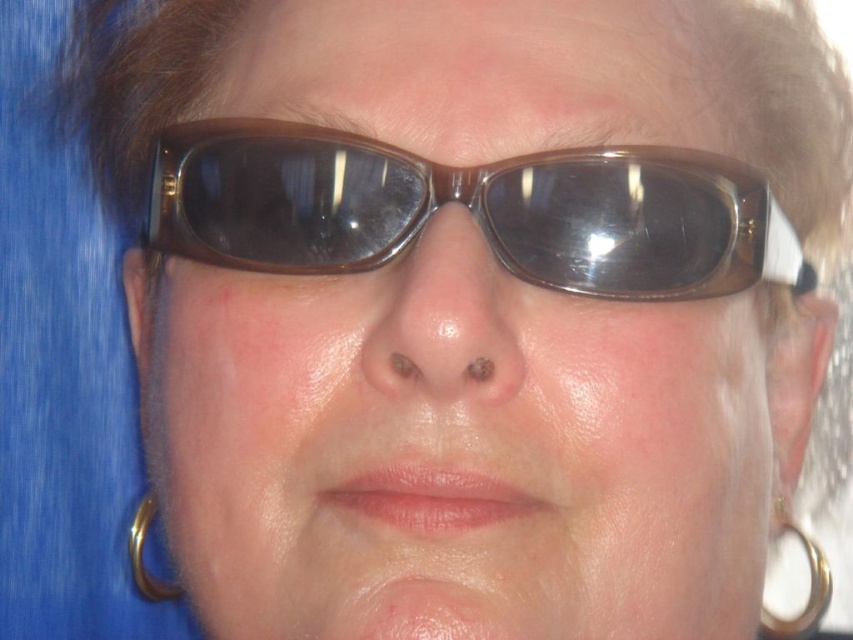
Does matte brown sunglasses at center appear under gold metallic hoop at lower right?

No.

How far apart are matte brown sunglasses at center and gold metallic hoop at lower right?

matte brown sunglasses at center is 7.67 inches away from gold metallic hoop at lower right.

In order to click on matte brown sunglasses at center in this screenshot , I will do `click(462, 451)`.

Can you confirm if matte brown sunglasses at center is positioned to the right of matte plastic nose at center?

Incorrect, matte brown sunglasses at center is not on the right side of matte plastic nose at center.

The image size is (853, 640). What are the coordinates of `matte brown sunglasses at center` in the screenshot? It's located at (462, 451).

Find the location of a particular element. Image resolution: width=853 pixels, height=640 pixels. matte brown sunglasses at center is located at coordinates (462, 451).

Does brown translucent glasses at center have a larger size compared to gold metallic hoop at lower right?

Correct, brown translucent glasses at center is larger in size than gold metallic hoop at lower right.

Between point (734, 170) and point (782, 529), which one is positioned in front?

Point (734, 170)

Where is `brown translucent glasses at center`? brown translucent glasses at center is located at coordinates (469, 211).